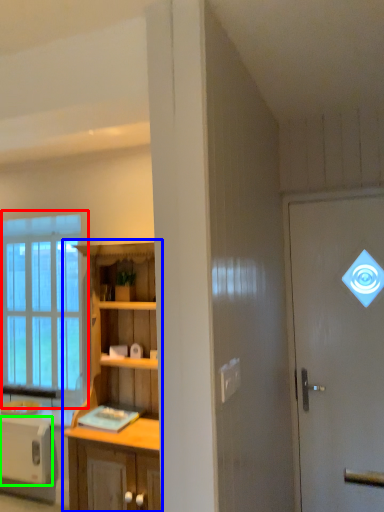
Question: Which object is positioned closest to window (highlighted by a red box)? Select from cabinetry (highlighted by a blue box) and appliance (highlighted by a green box).

Choices:
 (A) cabinetry
 (B) appliance

Answer: (B)